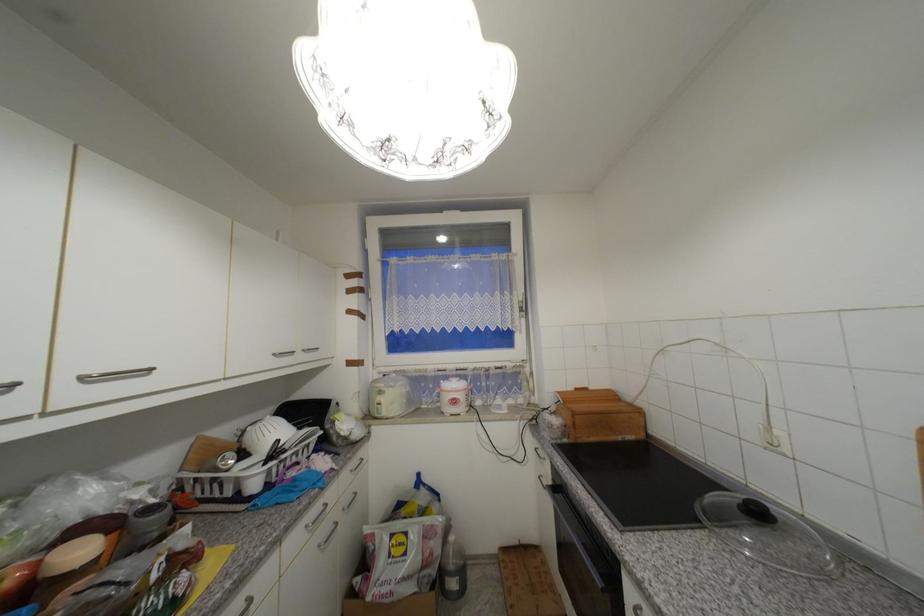
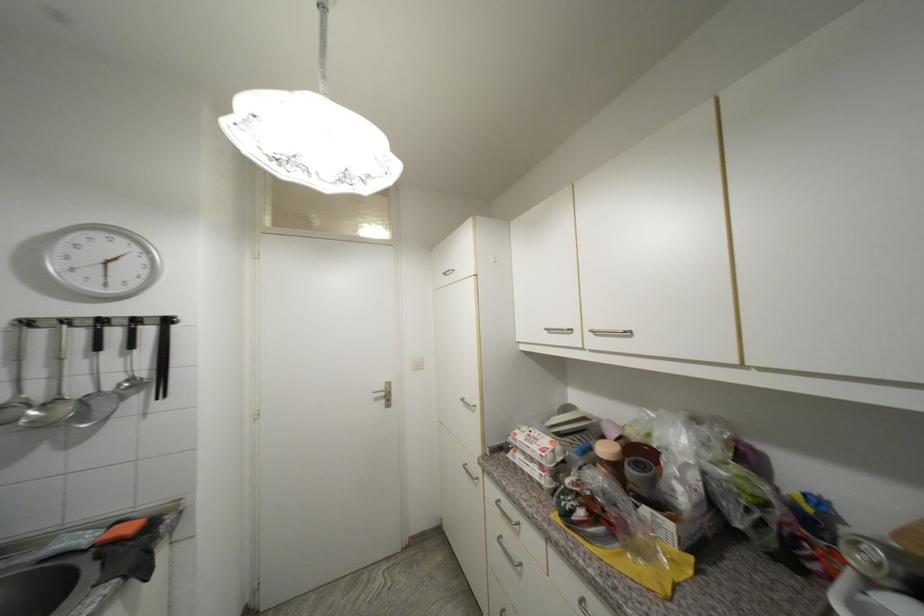
Where in the second image is the point corresponding to [102,373] from the first image?

(601, 330)